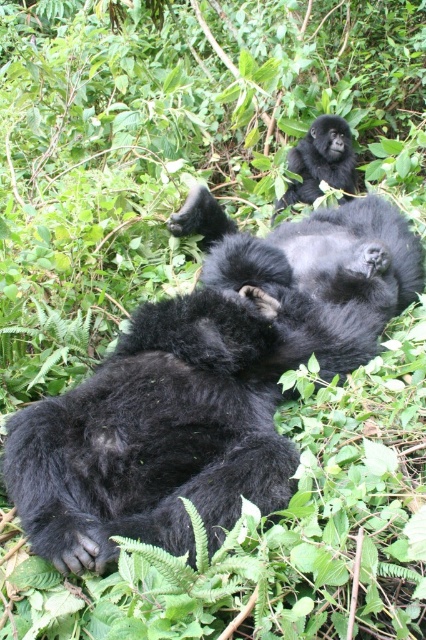
Which is below, black fuzzy gorilla at center or shiny black gorilla at upper center?

black fuzzy gorilla at center is lower down.

Identify the location of black fuzzy gorilla at center. (316, 272).

You are a GUI agent. You are given a task and a screenshot of the screen. Output one action in this format:
    pyautogui.click(x=<x>, y=<y>)
    Task: Click on the black fuzzy gorilla at center
    The width and height of the screenshot is (426, 640).
    Given the screenshot: What is the action you would take?
    pyautogui.click(x=316, y=272)